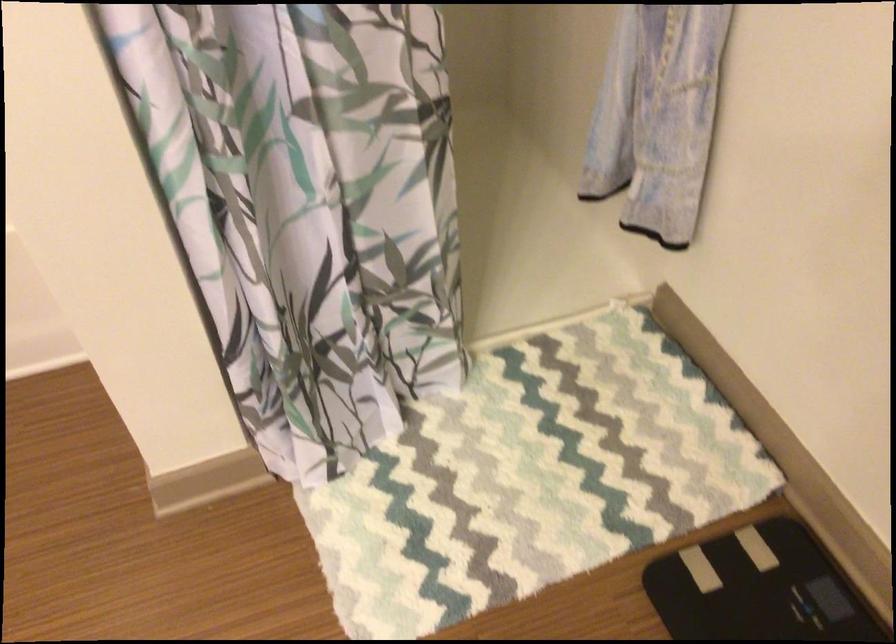
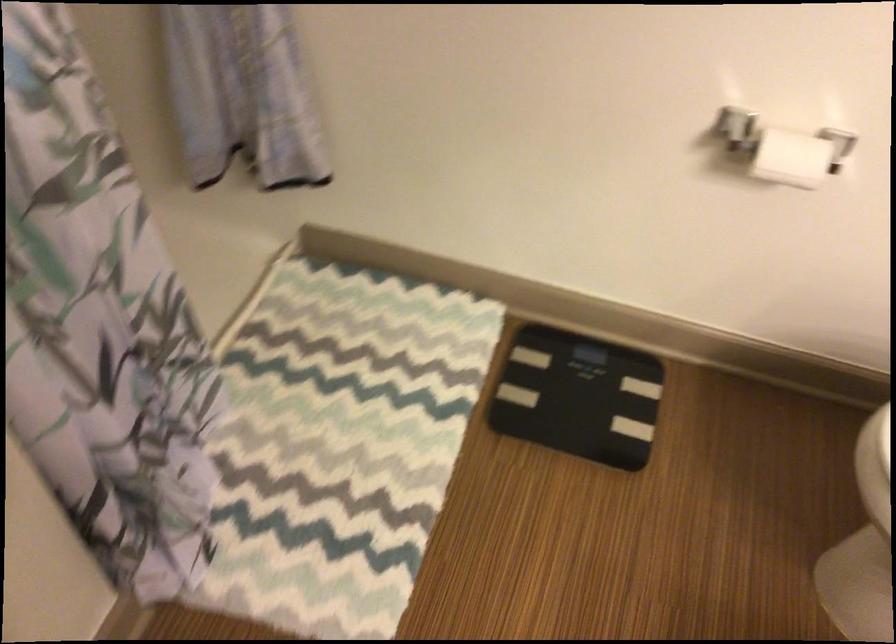
Question: The images are taken continuously from a first-person perspective. In which direction is your viewpoint rotating?

Choices:
 (A) Left
 (B) Right
 (C) Up
 (D) Down

Answer: (B)